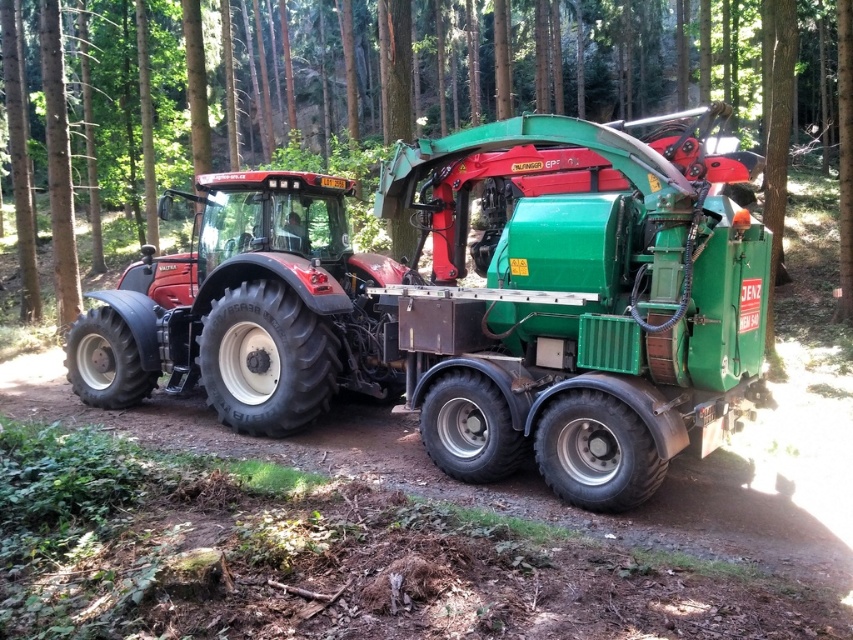
Question: Among these objects, which one is farthest from the camera?

Choices:
 (A) green metallic truck at center
 (B) matte black tractor at center

Answer: (A)

Question: Can you confirm if matte black tractor at center is wider than green metallic truck at center?

Choices:
 (A) yes
 (B) no

Answer: (B)

Question: Can you confirm if matte black tractor at center is positioned to the left of green metallic truck at center?

Choices:
 (A) no
 (B) yes

Answer: (A)

Question: Does matte black tractor at center have a lesser width compared to green metallic truck at center?

Choices:
 (A) no
 (B) yes

Answer: (B)

Question: Which point is closer to the camera?

Choices:
 (A) green metallic truck at center
 (B) matte black tractor at center

Answer: (B)